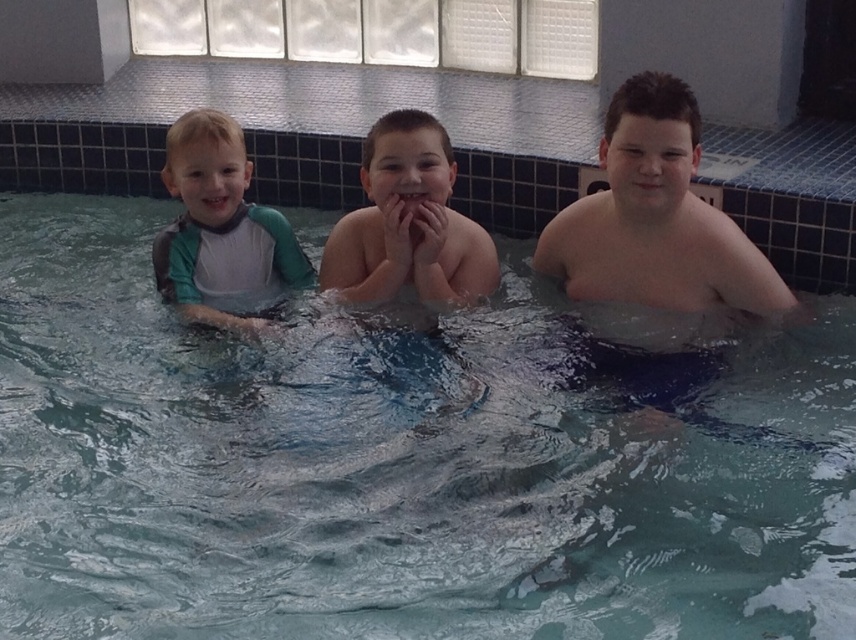
Question: Which point is closer to the camera taking this photo?

Choices:
 (A) (449, 275)
 (B) (217, 220)
 (C) (167, 609)
 (D) (595, 225)

Answer: (C)

Question: Among these objects, which one is nearest to the camera?

Choices:
 (A) green-gray wetsuit at left
 (B) clear blue water at center
 (C) smooth skin child at center

Answer: (B)

Question: Can you confirm if smooth skin boy at right is positioned above smooth skin child at center?

Choices:
 (A) no
 (B) yes

Answer: (A)

Question: Does smooth skin boy at right appear on the right side of smooth skin child at center?

Choices:
 (A) no
 (B) yes

Answer: (B)

Question: Which point appears farthest from the camera in this image?

Choices:
 (A) (164, 538)
 (B) (420, 273)
 (C) (645, 298)
 (D) (209, 166)

Answer: (C)

Question: Observing the image, what is the correct spatial positioning of smooth skin boy at right in reference to smooth skin child at center?

Choices:
 (A) below
 (B) above

Answer: (A)